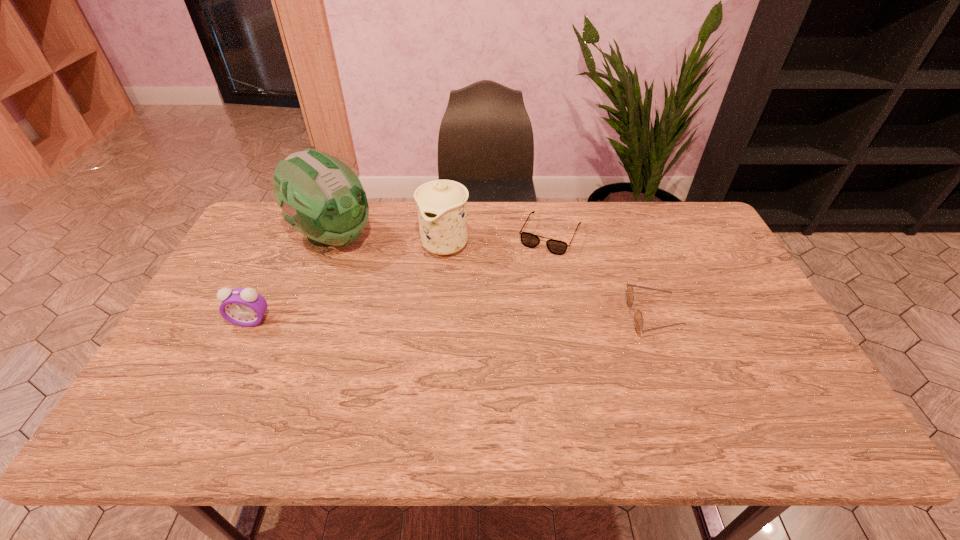
Where is `alarm clock`? The width and height of the screenshot is (960, 540). alarm clock is located at coordinates (244, 307).

Where is `the rightmost object`? the rightmost object is located at coordinates (638, 318).

The height and width of the screenshot is (540, 960). Find the location of `the right spectacles`. the right spectacles is located at coordinates (638, 318).

The width and height of the screenshot is (960, 540). I want to click on the second tallest object, so click(441, 204).

Locate an element on the screen. The width and height of the screenshot is (960, 540). chinaware is located at coordinates (441, 204).

At what (x,y) coordinates should I click in order to perform the action: click on the tallest object. Please return your answer as a coordinate pair (x, y). The width and height of the screenshot is (960, 540). Looking at the image, I should click on (321, 197).

Locate an element on the screen. the left spectacles is located at coordinates (557, 247).

Where is `the farther spectacles`? Image resolution: width=960 pixels, height=540 pixels. the farther spectacles is located at coordinates (557, 247).

This screenshot has width=960, height=540. What are the coordinates of `blank space located 0.140m on the face of the alarm clock` in the screenshot? It's located at pyautogui.click(x=227, y=371).

Identify the location of free location located on the front-facing side of the rightmost object. (708, 316).